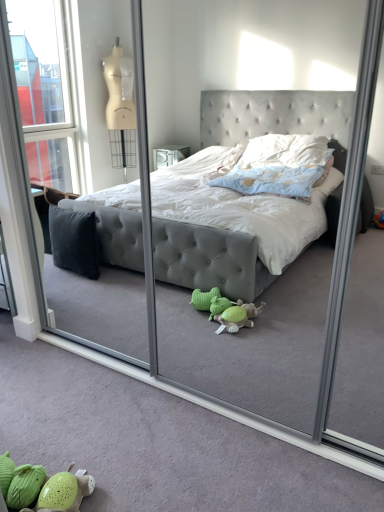
Question: Should I look upward or downward to see soft green plush toy at lower left?

Choices:
 (A) down
 (B) up

Answer: (A)